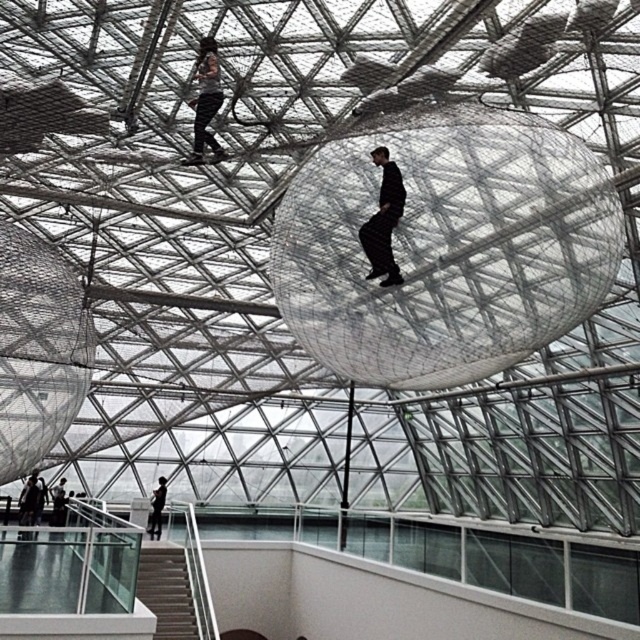
Is point (416, 250) closer to viewer compared to point (164, 556)?

Yes.

At what (x,y) coordinates should I click in order to perform the action: click on transparent mesh bubble at center. Please return your answer as a coordinate pair (x, y). The width and height of the screenshot is (640, 640). Looking at the image, I should click on (445, 246).

Which is behind, point (573, 256) or point (168, 608)?

Positioned behind is point (168, 608).

At what (x,y) coordinates should I click in order to perform the action: click on transparent mesh bubble at center. Please return your answer as a coordinate pair (x, y). This screenshot has height=640, width=640. Looking at the image, I should click on (445, 246).

Who is positioned more to the left, black matte suit at center or black matte person at lower center?

From the viewer's perspective, black matte person at lower center appears more on the left side.

Which is more to the right, black matte suit at center or black matte person at lower center?

black matte suit at center is more to the right.

Between point (372, 266) and point (161, 480), which one is positioned in front?

Point (372, 266) is in front.

Find the location of a particular element. This screenshot has width=640, height=640. black matte suit at center is located at coordinates (384, 221).

In order to click on white glossy stair at lower left in this screenshot , I will do `click(166, 589)`.

Is white glossy stair at lower left shorter than black matte suit at center?

Correct, white glossy stair at lower left is not as tall as black matte suit at center.

The width and height of the screenshot is (640, 640). What are the coordinates of `white glossy stair at lower left` in the screenshot? It's located at (166, 589).